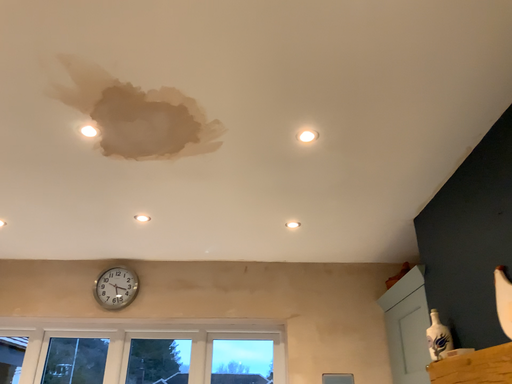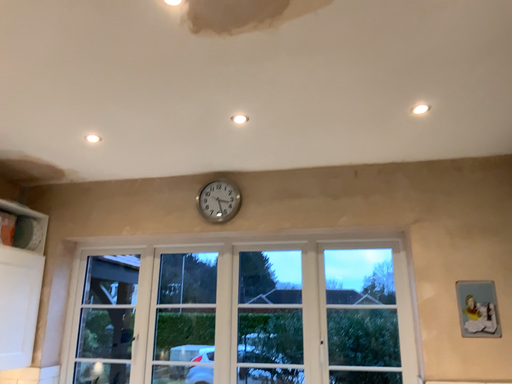
Question: Which way did the camera rotate in the video?

Choices:
 (A) rotated upward
 (B) rotated downward

Answer: (B)